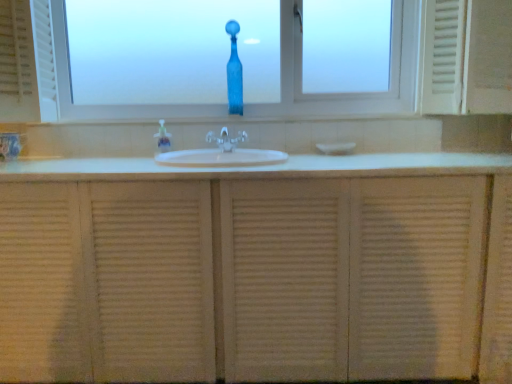
Image resolution: width=512 pixels, height=384 pixels. I want to click on vacant region to the right of translucent plastic soap dispenser at center, so click(189, 147).